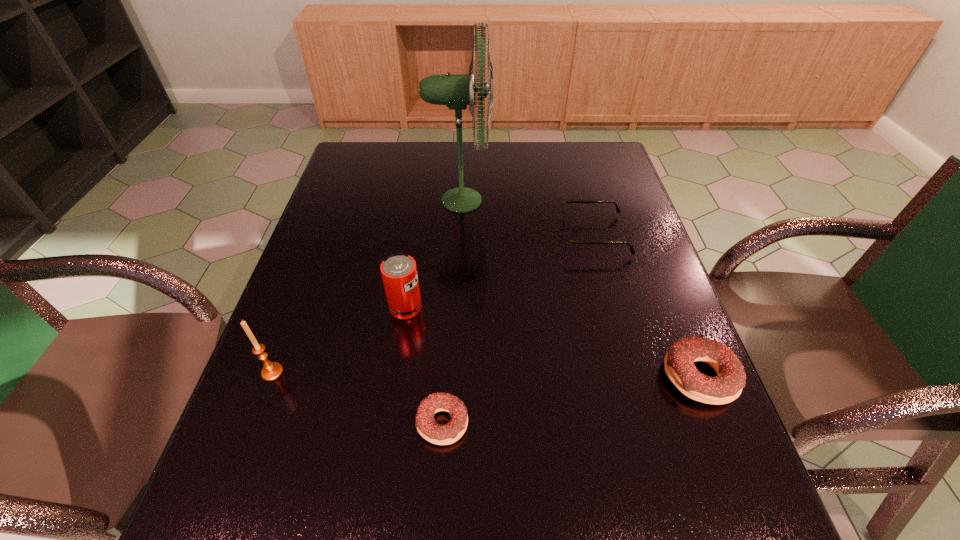
To make them evenly spaced by inserting another doughnut among them, please locate a free space for this new doughnut. Please provide its 2D coordinates. Your answer should be formatted as a tuple, i.e. [(x, y)], where the tuple contains the x and y coordinates of a point satisfying the conditions above.

[(576, 399)]